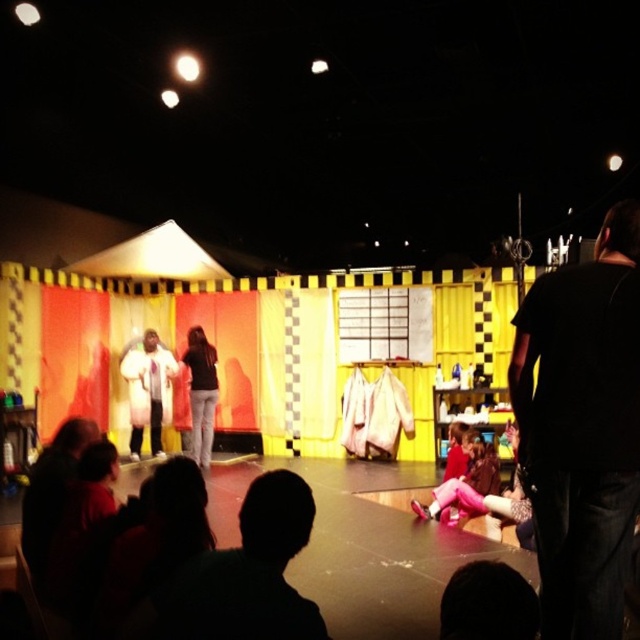
Question: Where is black t-shirt at right located in relation to black matte jacket at center in the image?

Choices:
 (A) left
 (B) right

Answer: (B)

Question: Can you confirm if pink fabric pants at center is thinner than black matte jacket at center?

Choices:
 (A) yes
 (B) no

Answer: (A)

Question: Among these objects, which one is nearest to the camera?

Choices:
 (A) white fluffy coat at center
 (B) silhouette head at lower center
 (C) pink fabric pants at center

Answer: (B)

Question: Is white fluffy coat at center positioned before pink fabric pants at center?

Choices:
 (A) no
 (B) yes

Answer: (A)

Question: Which point is closer to the camera?

Choices:
 (A) pink fabric pants at center
 (B) black matte jacket at center

Answer: (A)

Question: Which object is positioned farthest from the silhouette head at lower center?

Choices:
 (A) pink fabric pants at center
 (B) white fluffy coat at center
 (C) black t-shirt at right

Answer: (B)